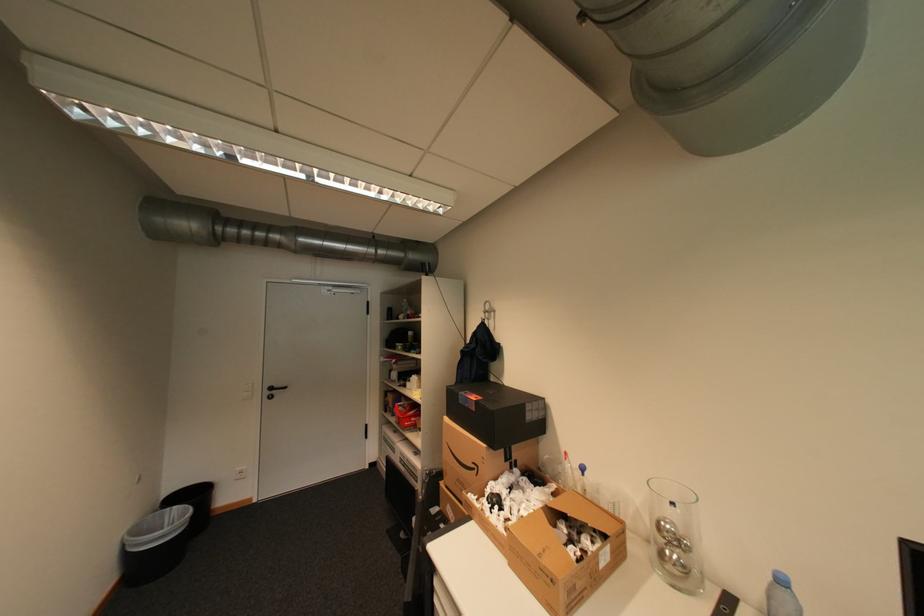
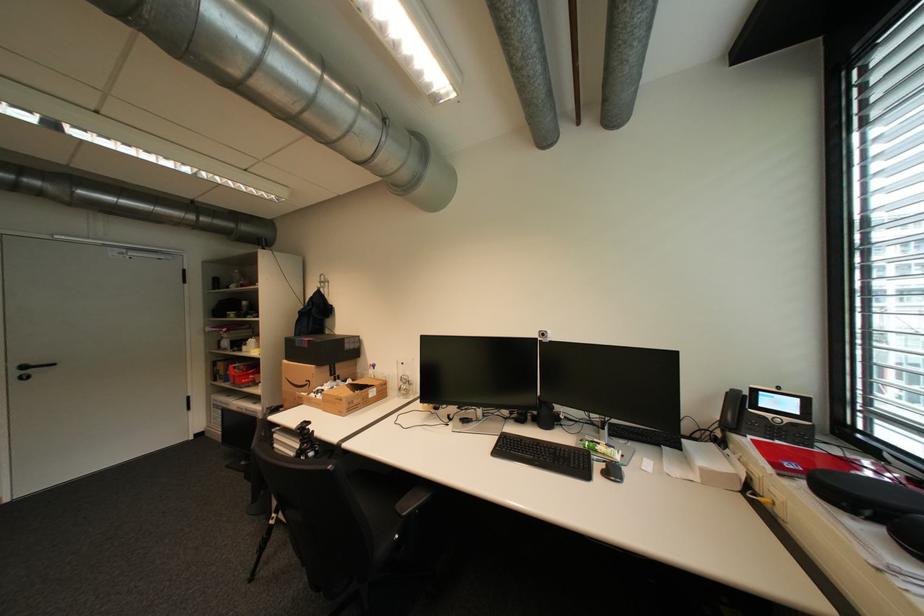
Question: I am providing you with two images of the same scene from different viewpoints. After the viewpoint changes to image2, which objects are now occluded?

Choices:
 (A) large cardboard box
 (B) black phone handset
 (C) black box
 (D) none of these

Answer: (D)